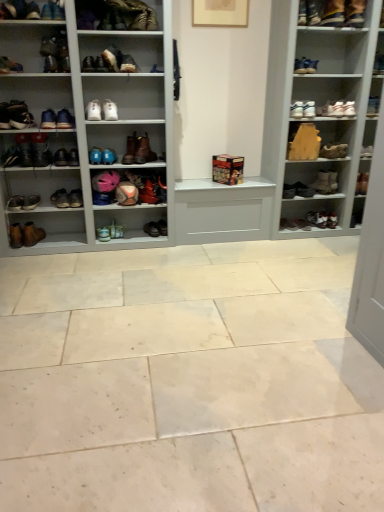
The image size is (384, 512). What do you see at coordinates (152, 229) in the screenshot?
I see `brown leather shoe at center, the ninth shoe viewed from the right` at bounding box center [152, 229].

Consider the image. How much space does brown leather shoe at center, placed as the twentieth shoe when sorted from left to right, occupy horizontally?

brown leather shoe at center, placed as the twentieth shoe when sorted from left to right, is 21.00 centimeters wide.

In order to face white leather shoe at upper center, the 15th shoe positioned from the left, should I rotate leftwards or rightwards?

It's best to rotate left around 12.872 degrees.

The width and height of the screenshot is (384, 512). What do you see at coordinates (40, 150) in the screenshot?
I see `brown leather boot at left, marked as the 25th shoe in a right-to-left arrangement` at bounding box center [40, 150].

The image size is (384, 512). What are the coordinates of `brown leather boot at left, marked as the 25th shoe in a right-to-left arrangement` in the screenshot? It's located at (x=40, y=150).

Where is `white suede boot at right, the fifth shoe when ordered from right to left`? white suede boot at right, the fifth shoe when ordered from right to left is located at coordinates (325, 182).

Identify the location of leather boot at right, the 28th shoe positioned from the left. Image resolution: width=384 pixels, height=512 pixels. (332, 220).

Where is `brown leather boot at center, the nineteenth shoe viewed from the left`? Image resolution: width=384 pixels, height=512 pixels. brown leather boot at center, the nineteenth shoe viewed from the left is located at coordinates point(130,149).

What is the approximate width of brown leather boot at center, the nineteenth shoe viewed from the left?

It is 10.22 inches.

The image size is (384, 512). What are the coordinates of `brown leather boot at lower left, marked as the 18th shoe in a right-to-left arrangement` in the screenshot? It's located at (75, 198).

Describe the element at coordinates (116, 15) in the screenshot. I see `leather boot at upper center, which ranks as the 4th footwear in left-to-right order` at that location.

This screenshot has height=512, width=384. I want to click on leather boot at upper center, marked as the 4th footwear in a right-to-left arrangement, so click(x=116, y=15).

Locate an element on the screen. brown leather shoe at center, the ninth shoe viewed from the right is located at coordinates (152, 229).

Find the location of a particular element. This screenshot has height=512, width=384. the 2nd shelf above the brown leather boot at left, which is counted as the fourth shoe, starting from the left (from the image's perspective) is located at coordinates (172, 132).

Is white glossy shoe rack at center, acting as the second shelf starting from the right, not close to brown leather boot at left, marked as the 25th shoe in a right-to-left arrangement?

Yes, white glossy shoe rack at center, acting as the second shelf starting from the right, is far from brown leather boot at left, marked as the 25th shoe in a right-to-left arrangement.

Considering the sizes of objects white glossy shoe rack at center, acting as the second shelf starting from the right, and brown leather boot at left, which is counted as the fourth shoe, starting from the left, in the image provided, who is smaller, white glossy shoe rack at center, acting as the second shelf starting from the right, or brown leather boot at left, which is counted as the fourth shoe, starting from the left,?

brown leather boot at left, which is counted as the fourth shoe, starting from the left, is smaller.

Is white glossy shoe rack at center, acting as the second shelf starting from the right, positioned behind brown leather boot at left, marked as the 25th shoe in a right-to-left arrangement?

No, it is not.

Is there a large distance between blue fabric shoe at center, arranged as the thirteenth shoe when viewed from the right, and brown leather boot at lower left, which appears as the 26th shoe when viewed from the right?

Actually, blue fabric shoe at center, arranged as the thirteenth shoe when viewed from the right, and brown leather boot at lower left, which appears as the 26th shoe when viewed from the right, are a little close together.

In order to click on shoe that is the 8th object located above the brown leather boot at lower left, which appears as the 26th shoe when viewed from the right (from the image's perspective) in this screenshot , I will do `click(109, 156)`.

Looking at their sizes, would you say blue fabric shoe at center, arranged as the thirteenth shoe when viewed from the right, is wider or thinner than brown leather boot at lower left, which appears as the 26th shoe when viewed from the right?

In the image, blue fabric shoe at center, arranged as the thirteenth shoe when viewed from the right, appears to be wider than brown leather boot at lower left, which appears as the 26th shoe when viewed from the right.

From the image's perspective, which is above, brown leather shoe at lower left, the 23th shoe positioned from the right, or brown leather shoe at center, placed as the twentieth shoe when sorted from left to right?

brown leather shoe at lower left, the 23th shoe positioned from the right, from the image's perspective.

Which is more to the left, brown leather shoe at lower left, the 23th shoe positioned from the right, or brown leather shoe at center, placed as the twentieth shoe when sorted from left to right?

brown leather shoe at lower left, the 23th shoe positioned from the right.

Based on the photo, how different are the orientations of brown leather shoe at lower left, the 6th shoe from the left, and brown leather shoe at center, the ninth shoe viewed from the right, in degrees?

There is a 4.09-degree angle between the facing directions of brown leather shoe at lower left, the 6th shoe from the left, and brown leather shoe at center, the ninth shoe viewed from the right.

From a real-world perspective, is white leather sneakers at upper right, arranged as the seventh footwear when viewed from the left, located higher than brown leather boot at right, the 7th shoe when ordered from right to left?

Yes, from a real-world perspective, white leather sneakers at upper right, arranged as the seventh footwear when viewed from the left, is over brown leather boot at right, the 7th shoe when ordered from right to left

Considering the sizes of white leather sneakers at upper right, arranged as the seventh footwear when viewed from the left, and brown leather boot at right, positioned as the 22th shoe in left-to-right order, in the image, is white leather sneakers at upper right, arranged as the seventh footwear when viewed from the left, bigger or smaller than brown leather boot at right, positioned as the 22th shoe in left-to-right order,?

Clearly, white leather sneakers at upper right, arranged as the seventh footwear when viewed from the left, is larger in size than brown leather boot at right, positioned as the 22th shoe in left-to-right order.

Which object is closer to the camera, white leather sneakers at upper right, the 1th footwear in the right-to-left sequence, or brown leather boot at right, the 7th shoe when ordered from right to left?

white leather sneakers at upper right, the 1th footwear in the right-to-left sequence, is more forward.

Is leather boot at upper center, marked as the fifth footwear in a right-to-left arrangement, inside the boundaries of leather boot at center, the 5th footwear from the left, or outside?

leather boot at upper center, marked as the fifth footwear in a right-to-left arrangement, exists outside the volume of leather boot at center, the 5th footwear from the left.

From a real-world perspective, between leather boot at upper center, which appears as the third footwear when viewed from the left, and leather boot at center, positioned as the 3th footwear in right-to-left order, who is vertically higher?

leather boot at upper center, which appears as the third footwear when viewed from the left, from a real-world perspective.

Is the position of leather boot at upper center, which appears as the third footwear when viewed from the left, more distant than that of leather boot at center, positioned as the 3th footwear in right-to-left order?

No, it is not.

From the image's perspective, is leather boot at upper center, which is counted as the 3th footwear, starting from the top, above or below leather boot at center, positioned as the 3th footwear in right-to-left order?

From the image's perspective, leather boot at upper center, which is counted as the 3th footwear, starting from the top, appears above leather boot at center, positioned as the 3th footwear in right-to-left order.

Who is more distant, wooden toy at center or matte brown boot at upper left, arranged as the fourth footwear when ordered from the bottom?

wooden toy at center is further away from the camera.

Which is in front, point (215, 165) or point (5, 64)?

Positioned in front is point (5, 64).

Considering the relative sizes of wooden toy at center and matte brown boot at upper left, the sixth footwear from the right, in the image provided, is wooden toy at center thinner than matte brown boot at upper left, the sixth footwear from the right,?

Yes, wooden toy at center is thinner than matte brown boot at upper left, the sixth footwear from the right.

From the image's perspective, between matte blue sneaker at center, which ranks as the fourteenth shoe in left-to-right order, and brown leather boot at left, the 21th shoe in the right-to-left sequence, which one is located above?

From the image's view, brown leather boot at left, the 21th shoe in the right-to-left sequence, is above.

Locate an element on the screen. This screenshot has width=384, height=512. the 8th shoe in front of the matte blue sneaker at center, acting as the 15th shoe starting from the right, counting from the anchor's position is located at coordinates (61, 157).

Could you tell me if matte blue sneaker at center, which ranks as the fourteenth shoe in left-to-right order, is facing brown leather boot at left, the eighth shoe in the left-to-right sequence?

No, matte blue sneaker at center, which ranks as the fourteenth shoe in left-to-right order, is not aimed at brown leather boot at left, the eighth shoe in the left-to-right sequence.

Considering the sizes of matte blue sneaker at center, which ranks as the fourteenth shoe in left-to-right order, and brown leather boot at left, the eighth shoe in the left-to-right sequence, in the image, is matte blue sneaker at center, which ranks as the fourteenth shoe in left-to-right order, wider or thinner than brown leather boot at left, the eighth shoe in the left-to-right sequence,?

In the image, matte blue sneaker at center, which ranks as the fourteenth shoe in left-to-right order, appears to be more narrow than brown leather boot at left, the eighth shoe in the left-to-right sequence.

Locate an element on the screen. The image size is (384, 512). shelf in front of the brown leather boot at left, which is counted as the fourth shoe, starting from the left is located at coordinates (172, 132).

Locate an element on the screen. the 13th shoe counting from the left of the blue fabric shoe at center, arranged as the thirteenth shoe when viewed from the right is located at coordinates (31, 202).

When comparing their distances from matte brown boot at center, the 12th shoe positioned from the right, does leather boot at right, acting as the 27th shoe starting from the left, or matte brown boot at upper center, placed as the sixteenth shoe when sorted from right to left, seem further?

Based on the image, leather boot at right, acting as the 27th shoe starting from the left, appears to be further to matte brown boot at center, the 12th shoe positioned from the right.

From the picture: Considering their positions, is matte brown boot at center, positioned as the eighth shoe in right-to-left order, positioned further to brown leather boot at right, the 7th shoe when ordered from right to left, than brown leather boot at left, marked as the 25th shoe in a right-to-left arrangement?

Based on the image, brown leather boot at left, marked as the 25th shoe in a right-to-left arrangement, appears to be further to brown leather boot at right, the 7th shoe when ordered from right to left.

Which object lies further to the anchor point brown leather boot at lower left, which appears as the 26th shoe when viewed from the right, shiny black shoe at right, placed as the 3th shoe when sorted from right to left, or matte brown boot at upper left, arranged as the 4th footwear when viewed from the top?

Among the two, shiny black shoe at right, placed as the 3th shoe when sorted from right to left, is located further to brown leather boot at lower left, which appears as the 26th shoe when viewed from the right.

Considering their positions, is wooden toy at center positioned closer to wooden shelf at upper right, which is counted as the 2th shelf, starting from the left, than white suede boot at right, the fifth shoe when ordered from right to left?

white suede boot at right, the fifth shoe when ordered from right to left, is closer to wooden shelf at upper right, which is counted as the 2th shelf, starting from the left.

Looking at the image, which one is located closer to white leather shoe at upper right, positioned as the 25th shoe in left-to-right order, leather boots at lower left, the first footwear in the left-to-right sequence, or white leather shoe at upper center, the 15th shoe positioned from the left?

white leather shoe at upper center, the 15th shoe positioned from the left, lies closer to white leather shoe at upper right, positioned as the 25th shoe in left-to-right order, than the other object.

Considering their positions, is matte black shoe at upper right, positioned as the 2th footwear in top-to-bottom order, positioned further to matte brown boot at center, which is the 17th shoe in left-to-right order, than white leather sneakers at upper right, the 1th footwear in the right-to-left sequence?

matte black shoe at upper right, positioned as the 2th footwear in top-to-bottom order, is further to matte brown boot at center, which is the 17th shoe in left-to-right order.

Considering their positions, is matte brown boot at upper center, placed as the 13th shoe when sorted from left to right, positioned closer to white leather shoe at upper center, the 15th shoe positioned from the left, than brown leather shoe at center, placed as the twentieth shoe when sorted from left to right?

Among the two, matte brown boot at upper center, placed as the 13th shoe when sorted from left to right, is located nearer to white leather shoe at upper center, the 15th shoe positioned from the left.

Estimate the real-world distances between objects in this image. Which object is closer to matte brown boot at upper left, arranged as the 4th footwear when viewed from the top, matte brown boot at upper left, which is the nineteenth shoe from right to left, or white glossy shoe rack at center, acting as the second shelf starting from the right?

matte brown boot at upper left, which is the nineteenth shoe from right to left, lies closer to matte brown boot at upper left, arranged as the 4th footwear when viewed from the top, than the other object.

You are a GUI agent. You are given a task and a screenshot of the screen. Output one action in this format:
    pyautogui.click(x=<x>, y=<y>)
    Task: Click on the concrete between matte black boot at upper left, placed as the 2th shoe when sorted from left to right, and leather boot at upper right, arranged as the 6th shoe when viewed from the right, in the horizontal direction
    The width and height of the screenshot is (384, 512).
    Given the screenshot: What is the action you would take?
    pyautogui.click(x=188, y=381)

Identify the location of toy between matte brown boot at upper left, which is the nineteenth shoe from right to left, and leather boot at right, marked as the first shoe in a right-to-left arrangement, from left to right. (227, 169).

The height and width of the screenshot is (512, 384). I want to click on shelf between brown leather boot at lower left, the 3th shoe from the left, and matte brown boot at center, positioned as the eighth shoe in right-to-left order, so click(172, 132).

The image size is (384, 512). I want to click on shelf positioned between beige tile floor at center and brown leather shoe at lower left, the 6th shoe from the left, from near to far, so click(x=172, y=132).